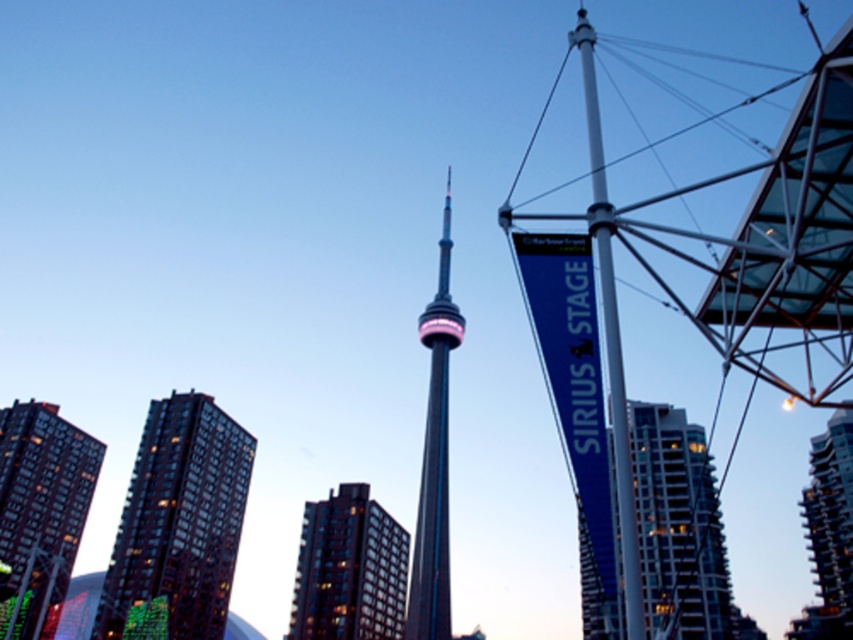
You are standing at the point indicated by point [680,531] in the image. What is the closest object to you?

The closest object to you is the glassy reflective skyscraper at center, as the point [680,531] indicates its location.

You are standing at the base of the CN Tower and want to take a photo of the Sirius Stage banner. The camera you have can only focus on objects within 150 meters. Is the point at coordinates point (27, 637) within the focus range of your camera?

The point at coordinates point (27, 637) is 141.65 meters from the viewer, which is within the camera focus range of 150 meters. Therefore, the camera can focus on the Sirius Stage banner at that point.